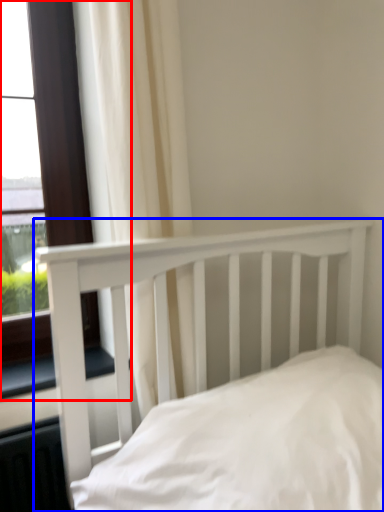
Question: Which object appears farthest to the camera in this image, window (highlighted by a red box) or bed (highlighted by a blue box)?

Choices:
 (A) window
 (B) bed

Answer: (A)